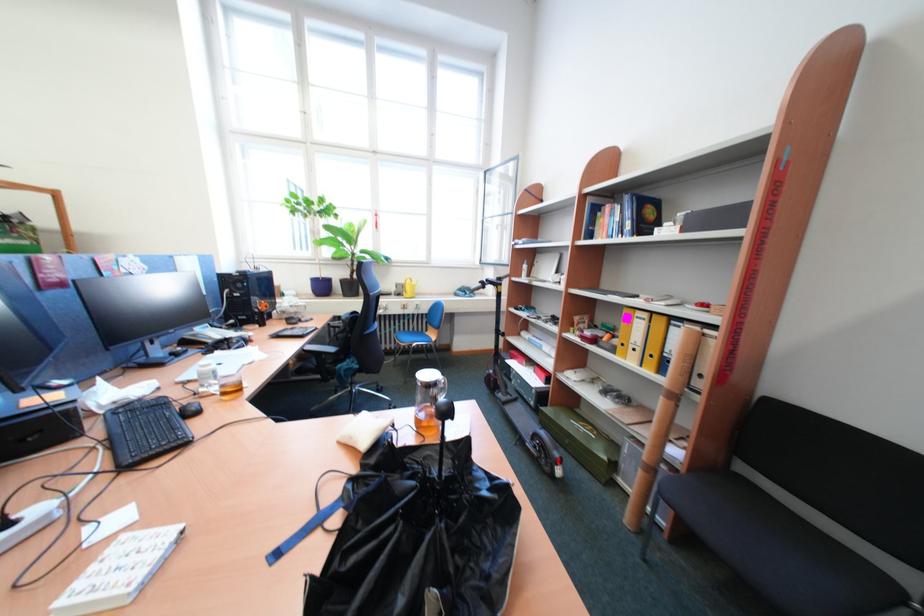
Locate an element on the screen. black plant pot is located at coordinates (349, 286).